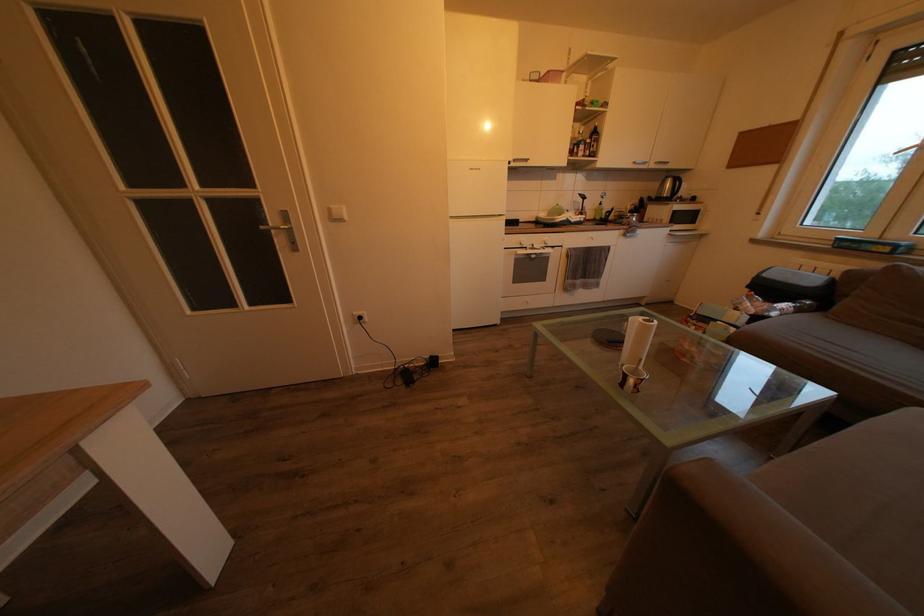
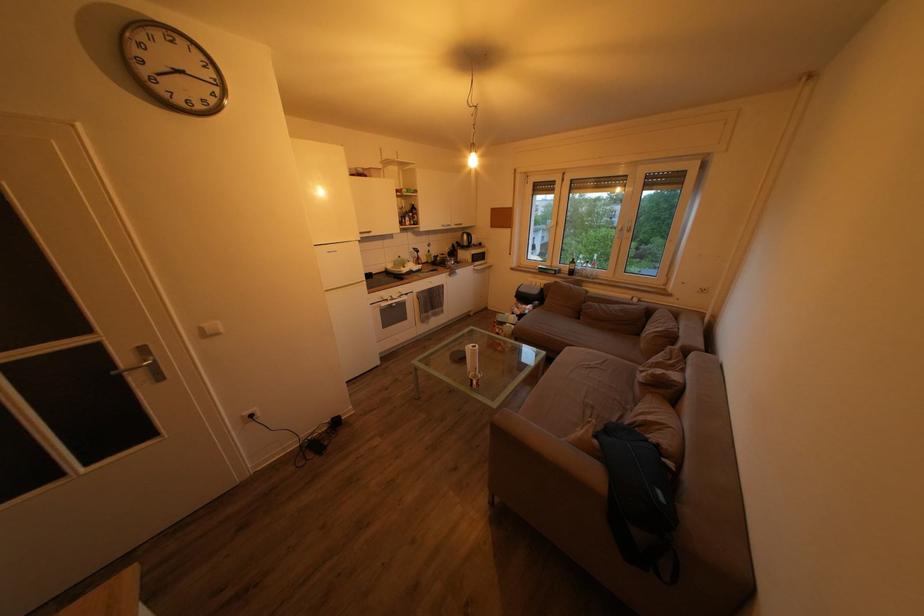
Find the pixel in the second image that matches pixel 619 347 in the first image.

(468, 365)